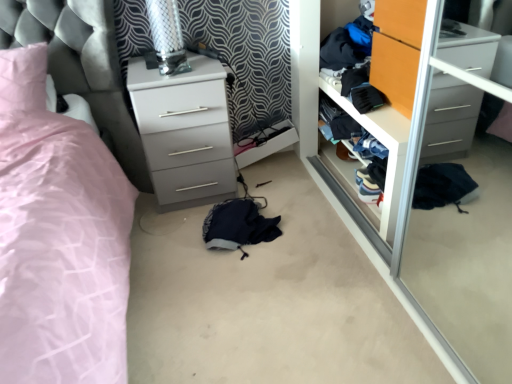
This screenshot has width=512, height=384. Find the location of `free space in front of wooden closet door at center`. free space in front of wooden closet door at center is located at coordinates (379, 246).